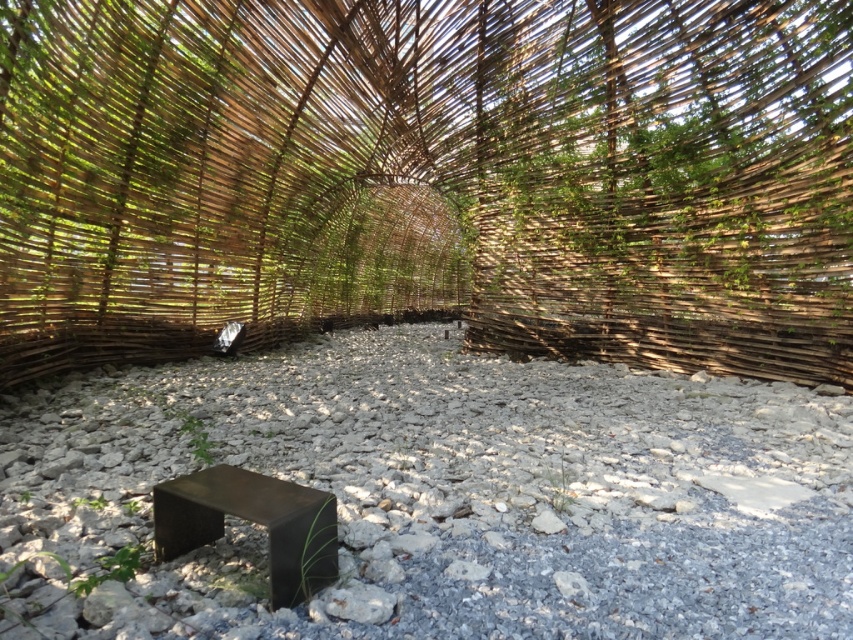
Is brown woven structure at center positioned at the back of gray gravel at center?

Yes.

Measure the distance between point (x=291, y=250) and camera.

Point (x=291, y=250) is 23.79 feet away from camera.

The image size is (853, 640). In order to click on brown woven structure at center in this screenshot , I will do `click(428, 177)`.

Between point (811, 406) and point (305, 493), which one is positioned in front?

Point (305, 493) is in front.

Is point (659, 464) positioned before point (216, 529)?

No, (659, 464) is further to viewer.

This screenshot has width=853, height=640. In order to click on gray gravel at center in this screenshot , I will do (x=444, y=496).

Is point (788, 4) positioned after point (306, 536)?

Yes.

Which is above, brown woven structure at center or black metal/stainless steel stool at lower left?

brown woven structure at center

Does point (106, 22) come farther from viewer compared to point (318, 536)?

That is True.

At what (x,y) coordinates should I click in order to perform the action: click on brown woven structure at center. Please return your answer as a coordinate pair (x, y). The height and width of the screenshot is (640, 853). Looking at the image, I should click on (428, 177).